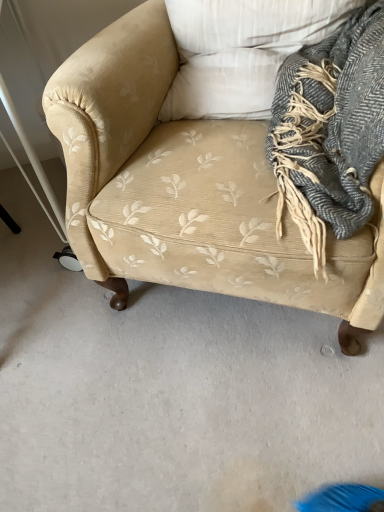
At what (x,y) coordinates should I click in order to perform the action: click on beige corduroy couch at center. Please return your answer as a coordinate pair (x, y). The height and width of the screenshot is (512, 384). Looking at the image, I should click on (189, 187).

What do you see at coordinates (240, 52) in the screenshot?
I see `white textured pillow at upper center` at bounding box center [240, 52].

Describe the element at coordinates (330, 131) in the screenshot. The height and width of the screenshot is (512, 384). I see `gray wool scarf at upper right` at that location.

Image resolution: width=384 pixels, height=512 pixels. In order to click on beige corduroy couch at center in this screenshot , I will do `click(189, 187)`.

Looking at their sizes, would you say gray wool scarf at upper right is wider or thinner than white textured pillow at upper center?

Clearly, gray wool scarf at upper right has more width compared to white textured pillow at upper center.

Is point (357, 192) positioned after point (202, 69)?

No, it is in front of (202, 69).

Is gray wool scarf at upper right further to the viewer compared to white textured pillow at upper center?

No, gray wool scarf at upper right is closer to the camera.

Is gray wool scarf at upper right not near white textured pillow at upper center?

No, there isn't a large distance between gray wool scarf at upper right and white textured pillow at upper center.

From a real-world perspective, is gray wool scarf at upper right positioned over beige corduroy couch at center based on gravity?

Yes, from a real-world perspective, gray wool scarf at upper right is above beige corduroy couch at center.

Considering the relative positions of gray wool scarf at upper right and beige corduroy couch at center in the image provided, is gray wool scarf at upper right behind beige corduroy couch at center?

Yes, the depth of gray wool scarf at upper right is greater than that of beige corduroy couch at center.

Is gray wool scarf at upper right in contact with beige corduroy couch at center?

gray wool scarf at upper right is not next to beige corduroy couch at center, and they're not touching.

From the image's perspective, which object appears higher, white textured pillow at upper center or gray wool scarf at upper right?

From the image's view, white textured pillow at upper center is above.

Does white textured pillow at upper center turn towards gray wool scarf at upper right?

Yes, white textured pillow at upper center is aimed at gray wool scarf at upper right.

Is point (310, 21) in front of point (351, 118)?

No.

Locate an element on the screen. pillow behind the gray wool scarf at upper right is located at coordinates (240, 52).

Considering the sizes of beige corduroy couch at center and gray wool scarf at upper right in the image, is beige corduroy couch at center wider or thinner than gray wool scarf at upper right?

In the image, beige corduroy couch at center appears to be wider than gray wool scarf at upper right.

The image size is (384, 512). Find the location of `studio couch beneath the gray wool scarf at upper right (from a real-world perspective)`. studio couch beneath the gray wool scarf at upper right (from a real-world perspective) is located at coordinates (189, 187).

Can we say beige corduroy couch at center lies outside gray wool scarf at upper right?

beige corduroy couch at center lies outside gray wool scarf at upper right's area.

From a real-world perspective, is beige corduroy couch at center above or below gray wool scarf at upper right?

beige corduroy couch at center is below gray wool scarf at upper right.

Considering their positions, is white textured pillow at upper center located in front of or behind beige corduroy couch at center?

In the image, white textured pillow at upper center appears behind beige corduroy couch at center.

Is white textured pillow at upper center facing away from beige corduroy couch at center?

Yes, white textured pillow at upper center is facing away from beige corduroy couch at center.

Is white textured pillow at upper center touching beige corduroy couch at center?

white textured pillow at upper center and beige corduroy couch at center are not in contact.

Who is shorter, white textured pillow at upper center or beige corduroy couch at center?

white textured pillow at upper center.

Considering their positions, is beige corduroy couch at center located in front of or behind white textured pillow at upper center?

beige corduroy couch at center is in front of white textured pillow at upper center.

Based on the photo, considering the sizes of objects beige corduroy couch at center and white textured pillow at upper center in the image provided, who is taller, beige corduroy couch at center or white textured pillow at upper center?

With more height is beige corduroy couch at center.

From the image's perspective, is beige corduroy couch at center located beneath white textured pillow at upper center?

Indeed, from the image's perspective, beige corduroy couch at center is shown beneath white textured pillow at upper center.

From a real-world perspective, who is located higher, beige corduroy couch at center or white textured pillow at upper center?

From a 3D spatial view, white textured pillow at upper center is above.

The image size is (384, 512). I want to click on scarf below the white textured pillow at upper center (from a real-world perspective), so click(330, 131).

Find the location of a particular element. The image size is (384, 512). scarf that is behind the beige corduroy couch at center is located at coordinates (330, 131).

Based on the photo, from the image, which object appears to be nearer to white textured pillow at upper center, gray wool scarf at upper right or beige corduroy couch at center?

The object closer to white textured pillow at upper center is beige corduroy couch at center.

From the picture: Estimate the real-world distances between objects in this image. Which object is closer to beige corduroy couch at center, white textured pillow at upper center or gray wool scarf at upper right?

The object closer to beige corduroy couch at center is white textured pillow at upper center.

Looking at this image, looking at the image, which one is located further to gray wool scarf at upper right, beige corduroy couch at center or white textured pillow at upper center?

beige corduroy couch at center is further to gray wool scarf at upper right.

Based on their spatial positions, is beige corduroy couch at center or gray wool scarf at upper right further from white textured pillow at upper center?

gray wool scarf at upper right.

From the image, which object appears to be farther from beige corduroy couch at center, gray wool scarf at upper right or white textured pillow at upper center?

gray wool scarf at upper right lies further to beige corduroy couch at center than the other object.

Based on their spatial positions, is white textured pillow at upper center or beige corduroy couch at center closer to gray wool scarf at upper right?

Based on the image, white textured pillow at upper center appears to be nearer to gray wool scarf at upper right.

Locate an element on the screen. The image size is (384, 512). scarf between beige corduroy couch at center and white textured pillow at upper center in the front-back direction is located at coordinates (330, 131).